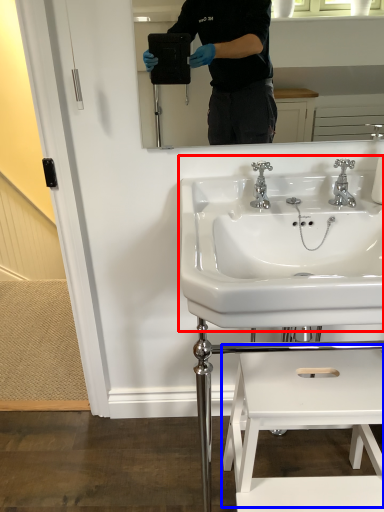
Question: Among these objects, which one is farthest to the camera, sink (highlighted by a red box) or step stool (highlighted by a blue box)?

Choices:
 (A) sink
 (B) step stool

Answer: (B)